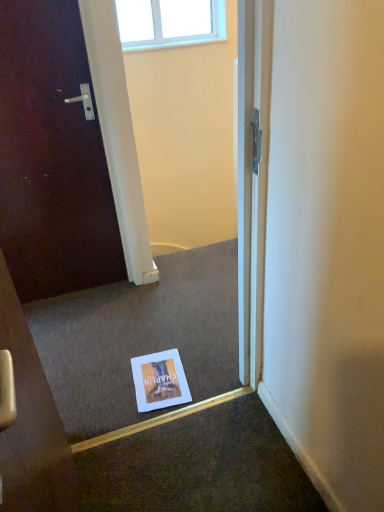
Find the location of a particular element. The width and height of the screenshot is (384, 512). vacant space situated above white paper flyer at center (from a real-world perspective) is located at coordinates click(x=158, y=377).